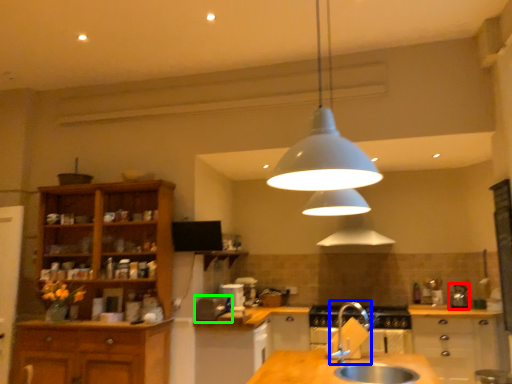
Question: Considering the real-world distances, which object is farthest from appliance (highlighted by a red box)? tap (highlighted by a blue box) or appliance (highlighted by a green box)?

Choices:
 (A) tap
 (B) appliance

Answer: (A)